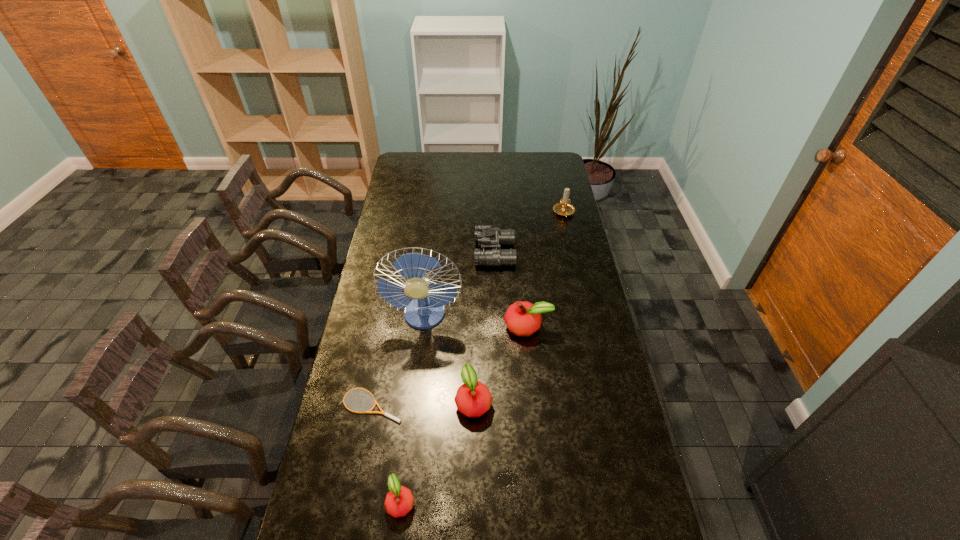
Please show where to add a apple on the right while keeping spacing even. Please provide its 2D coordinates. Your answer should be formatted as a tuple, i.e. [(x, y)], where the tuple contains the x and y coordinates of a point satisfying the conditions above.

[(568, 269)]